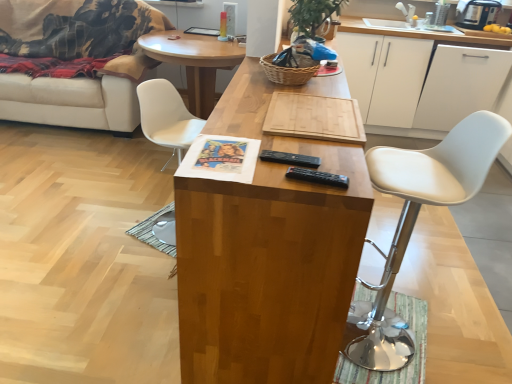
How much space does white matte cabinet at upper right, the first cabinetry positioned from the left, occupy vertically?

white matte cabinet at upper right, the first cabinetry positioned from the left, is 35.98 inches in height.

Where is `white matte cabinet at upper right, the first cabinetry positioned from the left`? white matte cabinet at upper right, the first cabinetry positioned from the left is located at coordinates (418, 80).

Find the location of a particular element. Image resolution: width=512 pixels, height=384 pixels. white fabric couch at left is located at coordinates (78, 60).

Where is `white leather stool at right, acting as the second chair starting from the left`? This screenshot has width=512, height=384. white leather stool at right, acting as the second chair starting from the left is located at coordinates (424, 203).

Locate an element on the screen. The width and height of the screenshot is (512, 384). white matte cabinet at upper right, marked as the 1th cabinetry in a right-to-left arrangement is located at coordinates (460, 85).

Is wooden cutting board at center, positioned as the second coffee table in back-to-front order, facing away from natural wood cutting board at center?

That's not correct — wooden cutting board at center, positioned as the second coffee table in back-to-front order, is not looking away from natural wood cutting board at center.

From their relative heights in the image, would you say wooden cutting board at center, positioned as the second coffee table in back-to-front order, is taller or shorter than natural wood cutting board at center?

Clearly, wooden cutting board at center, positioned as the second coffee table in back-to-front order, is taller compared to natural wood cutting board at center.

Is wooden cutting board at center, positioned as the second coffee table in back-to-front order, next to natural wood cutting board at center?

No, wooden cutting board at center, positioned as the second coffee table in back-to-front order, is not next to natural wood cutting board at center.

Between wooden cutting board at center, positioned as the second coffee table in back-to-front order, and natural wood cutting board at center, which one appears on the right side from the viewer's perspective?

natural wood cutting board at center.

Could you measure the distance between natural wood cutting board at center and white matte cabinet at upper right, the 2th cabinetry when ordered from right to left?

A: natural wood cutting board at center and white matte cabinet at upper right, the 2th cabinetry when ordered from right to left, are 7.19 feet apart.

From the image's perspective, is natural wood cutting board at center on top of white matte cabinet at upper right, the 2th cabinetry when ordered from right to left?

No, from the image's perspective, natural wood cutting board at center is not over white matte cabinet at upper right, the 2th cabinetry when ordered from right to left.

Is natural wood cutting board at center outside of white matte cabinet at upper right, the first cabinetry positioned from the left?

Yes, natural wood cutting board at center is outside of white matte cabinet at upper right, the first cabinetry positioned from the left.

How many degrees apart are the facing directions of natural wood cutting board at center and white matte cabinet at upper right, the first cabinetry positioned from the left?

86.5 degrees separate the facing orientations of natural wood cutting board at center and white matte cabinet at upper right, the first cabinetry positioned from the left.

Is woven brown basket at center positioned far away from white matte cabinet at upper right, which appears as the second cabinetry when viewed from the left?

Yes, woven brown basket at center and white matte cabinet at upper right, which appears as the second cabinetry when viewed from the left, are located far from each other.

Locate an element on the screen. basket below the white matte cabinet at upper right, which appears as the second cabinetry when viewed from the left (from the image's perspective) is located at coordinates (286, 72).

From a real-world perspective, between woven brown basket at center and white matte cabinet at upper right, which appears as the second cabinetry when viewed from the left, who is vertically lower?

From a 3D spatial view, white matte cabinet at upper right, which appears as the second cabinetry when viewed from the left, is below.

In the scene shown: How much distance is there between woven brown basket at center and white matte cabinet at upper right, which appears as the second cabinetry when viewed from the left?

They are 6.98 feet apart.

Does white matte cabinet at upper right, which appears as the second cabinetry when viewed from the left, contain natural wood cutting board at center?

That's incorrect, natural wood cutting board at center is not inside white matte cabinet at upper right, which appears as the second cabinetry when viewed from the left.

Considering the sizes of white matte cabinet at upper right, marked as the 1th cabinetry in a right-to-left arrangement, and natural wood cutting board at center in the image, is white matte cabinet at upper right, marked as the 1th cabinetry in a right-to-left arrangement, wider or thinner than natural wood cutting board at center?

In the image, white matte cabinet at upper right, marked as the 1th cabinetry in a right-to-left arrangement, appears to be wider than natural wood cutting board at center.

Is white matte cabinet at upper right, marked as the 1th cabinetry in a right-to-left arrangement, looking in the opposite direction of natural wood cutting board at center?

No, white matte cabinet at upper right, marked as the 1th cabinetry in a right-to-left arrangement, is not facing away from natural wood cutting board at center.

From the image's perspective, which object appears higher, white matte cabinet at upper right, marked as the 1th cabinetry in a right-to-left arrangement, or natural wood cutting board at center?

white matte cabinet at upper right, marked as the 1th cabinetry in a right-to-left arrangement, appears higher in the image.

How much distance is there between white fabric couch at left and natural wood cutting board at center?

They are 2.57 meters apart.

Are white fabric couch at left and natural wood cutting board at center beside each other?

white fabric couch at left and natural wood cutting board at center are clearly separated.

From a real-world perspective, which object rests below the other?

From a 3D spatial view, white fabric couch at left is below.

Can we say wooden cutting board at center, which is the 1th coffee table in front-to-back order, lies outside wooden cutting board at center, acting as the first coffee table starting from the back?

wooden cutting board at center, which is the 1th coffee table in front-to-back order, lies outside wooden cutting board at center, acting as the first coffee table starting from the back,'s area.

Which is behind, point (208, 207) or point (179, 56)?

The point (179, 56) is farther.

Who is bigger, wooden cutting board at center, positioned as the second coffee table in back-to-front order, or wooden cutting board at center, which appears as the 2th coffee table when viewed from the front?

wooden cutting board at center, positioned as the second coffee table in back-to-front order, is bigger.

Between wooden cutting board at center, which is the 1th coffee table in front-to-back order, and wooden cutting board at center, acting as the first coffee table starting from the back, which one has more height?

Standing taller between the two is wooden cutting board at center, which is the 1th coffee table in front-to-back order.

In order to click on studio couch below the woven brown basket at center (from a real-world perspective) in this screenshot , I will do `click(78, 60)`.

Considering the positions of objects woven brown basket at center and white fabric couch at left in the image provided, who is in front, woven brown basket at center or white fabric couch at left?

woven brown basket at center is closer to the camera.

Measure the distance from woven brown basket at center to white fabric couch at left.

7.49 feet.

Find the location of a particular element. This screenshot has width=512, height=384. plank to the right of wooden cutting board at center, which is the 1th coffee table in front-to-back order is located at coordinates (314, 118).

This screenshot has height=384, width=512. In order to click on plank that appears above the white matte cabinet at upper right, the first cabinetry positioned from the left (from a real-world perspective) in this screenshot , I will do pos(314,118).

Which object lies further to the anchor point white matte cabinet at upper right, which appears as the second cabinetry when viewed from the left, wooden cutting board at center, acting as the first coffee table starting from the back, or white leather stool at right, acting as the second chair starting from the left?

white leather stool at right, acting as the second chair starting from the left, lies further to white matte cabinet at upper right, which appears as the second cabinetry when viewed from the left, than the other object.

Which object lies nearer to the anchor point white leather stool at right, acting as the second chair starting from the left, white fabric couch at left or natural wood cutting board at center?

natural wood cutting board at center is closer to white leather stool at right, acting as the second chair starting from the left.

When comparing their distances from white matte cabinet at upper right, the 2th cabinetry when ordered from right to left, does white plastic chair at center, positioned as the 2th chair in right-to-left order, or white matte cabinet at upper right, marked as the 1th cabinetry in a right-to-left arrangement, seem closer?

white matte cabinet at upper right, marked as the 1th cabinetry in a right-to-left arrangement, is positioned closer to the anchor white matte cabinet at upper right, the 2th cabinetry when ordered from right to left.

From the image, which object appears to be nearer to white matte cabinet at upper right, the 2th cabinetry when ordered from right to left, wooden cutting board at center, acting as the first coffee table starting from the back, or white plastic chair at center, positioned as the 2th chair in right-to-left order?

wooden cutting board at center, acting as the first coffee table starting from the back, is positioned closer to the anchor white matte cabinet at upper right, the 2th cabinetry when ordered from right to left.

From the image, which object appears to be nearer to natural wood cutting board at center, white matte cabinet at upper right, the 2th cabinetry when ordered from right to left, or wooden cutting board at center, which is the 1th coffee table in front-to-back order?

The object closer to natural wood cutting board at center is wooden cutting board at center, which is the 1th coffee table in front-to-back order.

Based on their spatial positions, is wooden cutting board at center, which appears as the 2th coffee table when viewed from the front, or white fabric couch at left closer to white matte cabinet at upper right, the first cabinetry positioned from the left?

The object closer to white matte cabinet at upper right, the first cabinetry positioned from the left, is wooden cutting board at center, which appears as the 2th coffee table when viewed from the front.

Estimate the real-world distances between objects in this image. Which object is closer to woven brown basket at center, white fabric couch at left or wooden cutting board at center, positioned as the second coffee table in back-to-front order?

The object closer to woven brown basket at center is wooden cutting board at center, positioned as the second coffee table in back-to-front order.

Considering their positions, is wooden cutting board at center, positioned as the second coffee table in back-to-front order, positioned further to white fabric couch at left than white matte cabinet at upper right, the 2th cabinetry when ordered from right to left?

Among the two, wooden cutting board at center, positioned as the second coffee table in back-to-front order, is located further to white fabric couch at left.

Where is `plank between white leather stool at right, which appears as the first chair when viewed from the right, and white matte cabinet at upper right, which appears as the second cabinetry when viewed from the left, from front to back`? plank between white leather stool at right, which appears as the first chair when viewed from the right, and white matte cabinet at upper right, which appears as the second cabinetry when viewed from the left, from front to back is located at coordinates (314, 118).

Where is `basket between natural wood cutting board at center and wooden cutting board at center, which appears as the 2th coffee table when viewed from the front, along the z-axis`? basket between natural wood cutting board at center and wooden cutting board at center, which appears as the 2th coffee table when viewed from the front, along the z-axis is located at coordinates (286, 72).

Image resolution: width=512 pixels, height=384 pixels. I want to click on plank positioned between wooden cutting board at center, positioned as the second coffee table in back-to-front order, and white plastic chair at center, which appears as the 2th chair when viewed from the front, from near to far, so click(x=314, y=118).

What are the coordinates of `chair between white fabric couch at left and wooden cutting board at center, which is the 1th coffee table in front-to-back order` in the screenshot? It's located at (166, 117).